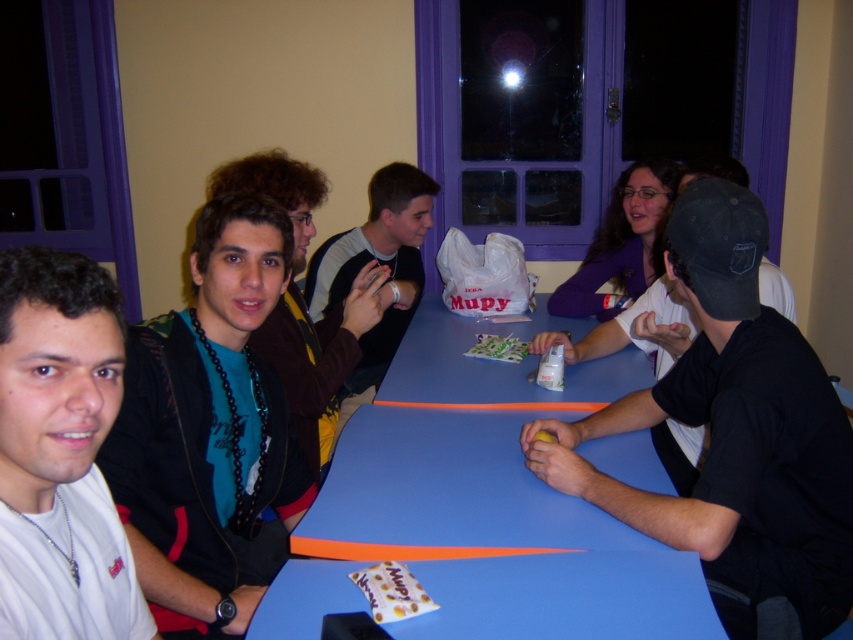
Is the position of black matte cap at right more distant than that of matte black shirt at center?

That is False.

The height and width of the screenshot is (640, 853). What do you see at coordinates (734, 436) in the screenshot?
I see `black matte cap at right` at bounding box center [734, 436].

You are a GUI agent. You are given a task and a screenshot of the screen. Output one action in this format:
    pyautogui.click(x=<x>, y=<y>)
    Task: Click on the black matte cap at right
    Image resolution: width=853 pixels, height=640 pixels.
    Given the screenshot: What is the action you would take?
    pyautogui.click(x=734, y=436)

Who is positioned more to the left, teal fabric shirt at center or matte black shirt at center?

teal fabric shirt at center is more to the left.

Is point (126, 496) positioned in front of point (323, 304)?

Yes.

Identify the location of teal fabric shirt at center. (209, 429).

How far apart are teal fabric shirt at center and white matte shirt at left?

teal fabric shirt at center and white matte shirt at left are 42.90 centimeters apart from each other.

Who is positioned more to the right, teal fabric shirt at center or white matte shirt at left?

teal fabric shirt at center

Is point (184, 326) farther from camera compared to point (109, 353)?

Yes.

Image resolution: width=853 pixels, height=640 pixels. Find the location of `teal fabric shirt at center`. teal fabric shirt at center is located at coordinates (209, 429).